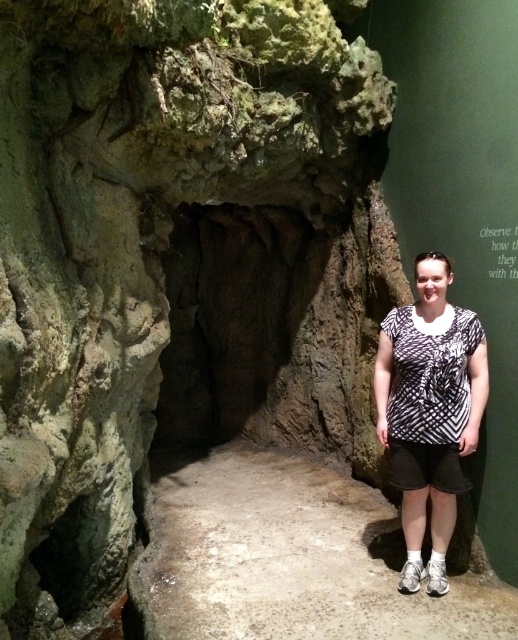
Question: Is printed fabric shirt at center to the left of black and white printed shirt at center from the viewer's perspective?

Choices:
 (A) no
 (B) yes

Answer: (A)

Question: Among these objects, which one is farthest from the camera?

Choices:
 (A) black and white printed shirt at center
 (B) printed fabric shirt at center

Answer: (B)

Question: Which point appears closest to the camera in this image?

Choices:
 (A) (401, 339)
 (B) (438, 474)

Answer: (B)

Question: Which of the following is the closest to the observer?

Choices:
 (A) (462, 333)
 (B) (393, 435)

Answer: (A)

Question: Does printed fabric shirt at center have a smaller size compared to black and white printed shirt at center?

Choices:
 (A) yes
 (B) no

Answer: (B)

Question: Is printed fabric shirt at center smaller than black and white printed shirt at center?

Choices:
 (A) no
 (B) yes

Answer: (A)